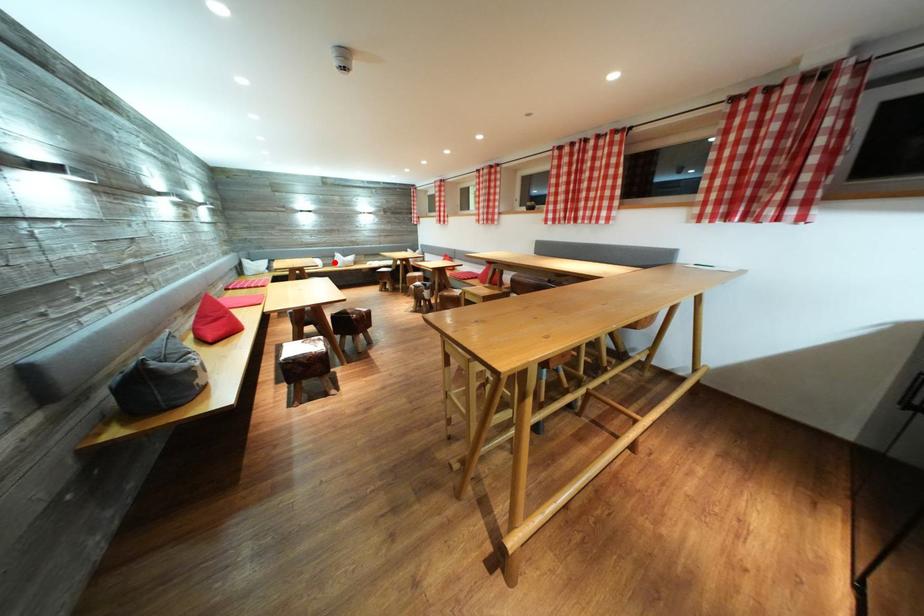
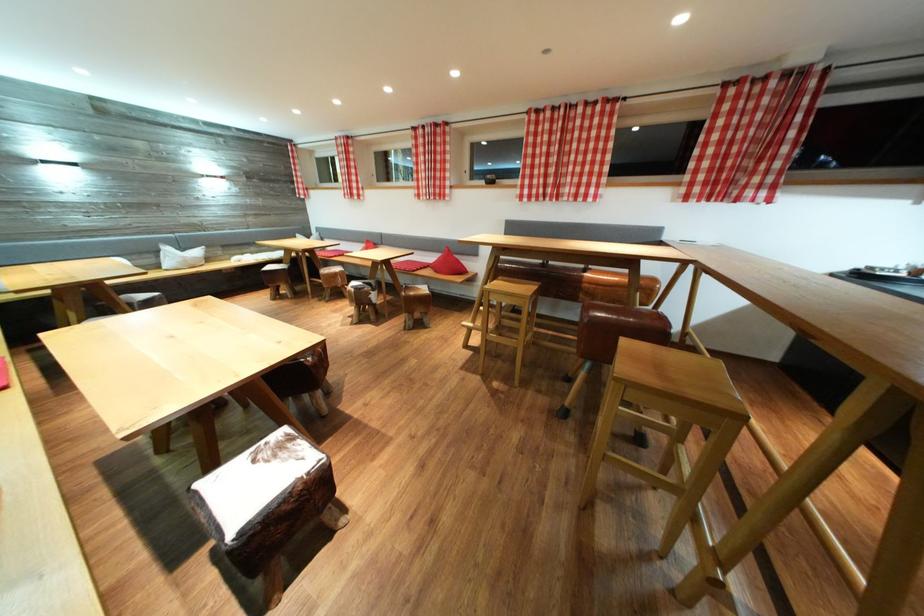
Question: I am providing you with two images of the same scene from different viewpoints. Image1 has a red point marked. In image2, the corresponding 3D location appears at what relative position? Reply with the corresponding letter.

Choices:
 (A) Closer
 (B) Farther

Answer: (B)